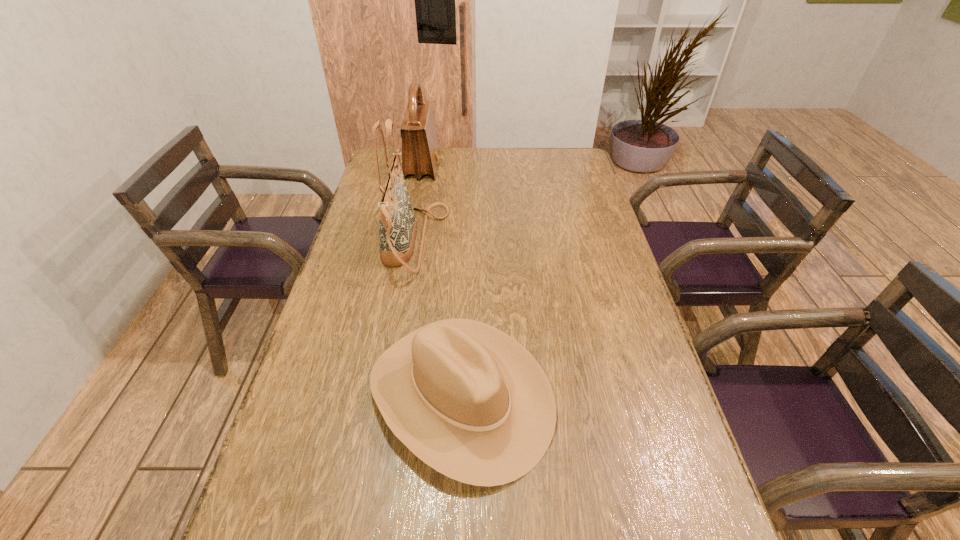
The height and width of the screenshot is (540, 960). Find the location of `the tallest object`. the tallest object is located at coordinates (397, 224).

Find the location of a particular element. The image size is (960, 540). the second nearest object is located at coordinates (397, 224).

Find the location of a particular element. The width and height of the screenshot is (960, 540). the second tallest object is located at coordinates (420, 151).

At what (x,y) coordinates should I click in order to perform the action: click on the farthest object. Please return your answer as a coordinate pair (x, y). Looking at the image, I should click on (420, 151).

Where is `the nearest object`? the nearest object is located at coordinates (471, 402).

What are the coordinates of `cowboy hat` in the screenshot? It's located at (471, 402).

The height and width of the screenshot is (540, 960). I want to click on vacant space located on the front-facing side of the second farthest object, so click(462, 241).

Where is `vacant space located 0.080m on the front flap of the second tallest object`? This screenshot has height=540, width=960. vacant space located 0.080m on the front flap of the second tallest object is located at coordinates (459, 167).

Find the location of `blank space located on the right of the shortest object`. blank space located on the right of the shortest object is located at coordinates (641, 395).

The image size is (960, 540). In order to click on object present at the far edge in this screenshot , I will do `click(420, 151)`.